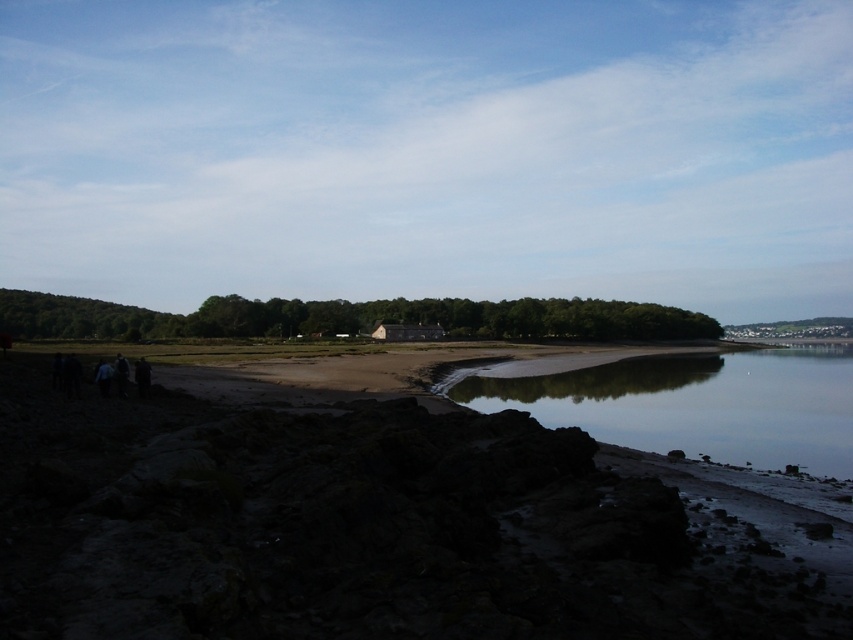
You are standing on the beach and want to take a photo of both the reflective smooth water at lower center and the dark gray wooden hut at center. Which object should you zoom in on first to ensure both are in frame?

You should zoom in on the reflective smooth water at lower center first because it is shorter than the dark gray wooden hut at center, so adjusting the frame to include the shorter object first will help capture both in the photo.

You are a photographer planning to capture the coastal scene. You want to focus on the dark sand beach at center and the reflective smooth water at lower center. Which of these two elements takes up more visual space in the image?

The reflective smooth water at lower center occupies more space than the dark sand beach at center in the image.

You are planning to build a small garden on the dark sand beach at center. Considering the space available, will there be enough room for both the garden and the dark gray wooden hut at center?

The dark sand beach at center occupies less space than the dark gray wooden hut at center, so there might not be enough room for both the garden and the hut.